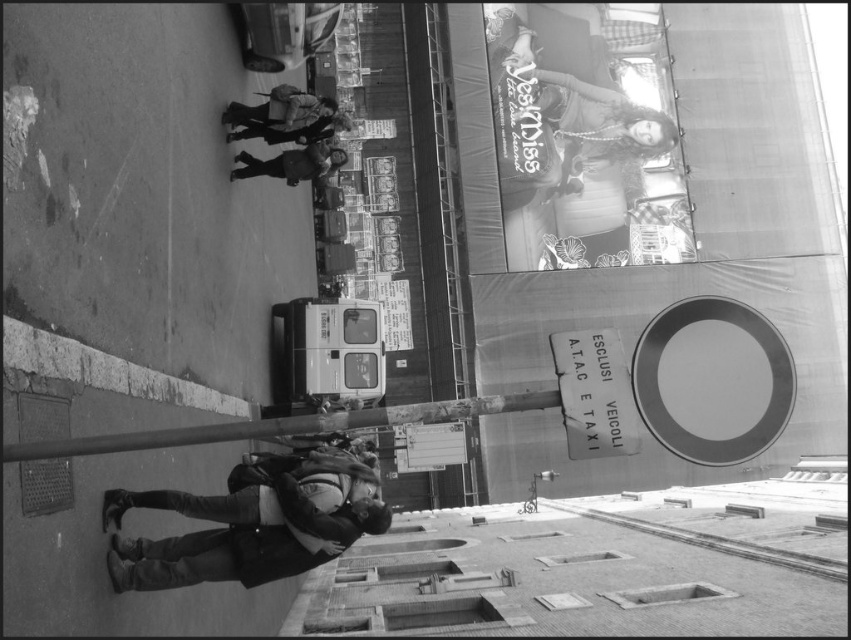
Which of these two, smooth metal pole at center or dark gray jacket at center, stands taller?

Standing taller between the two is dark gray jacket at center.

Is point (391, 413) farther from viewer compared to point (329, 148)?

No, it is in front of (329, 148).

This screenshot has height=640, width=851. Describe the element at coordinates (283, 426) in the screenshot. I see `smooth metal pole at center` at that location.

You are a GUI agent. You are given a task and a screenshot of the screen. Output one action in this format:
    pyautogui.click(x=<x>, y=<y>)
    Task: Click on the smooth metal pole at center
    The image size is (851, 640).
    Given the screenshot: What is the action you would take?
    pyautogui.click(x=283, y=426)